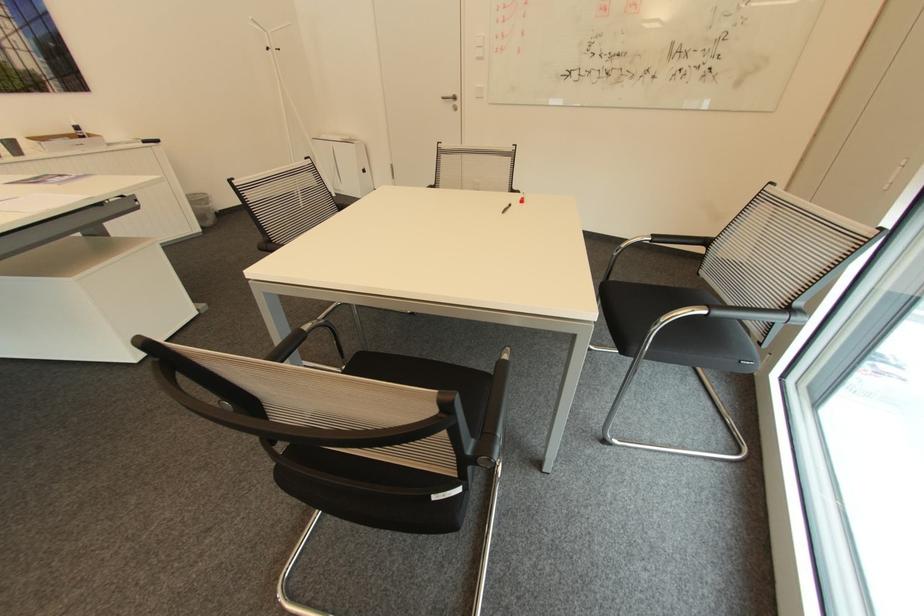
Identify the location of black pen. Image resolution: width=924 pixels, height=616 pixels. (505, 208).